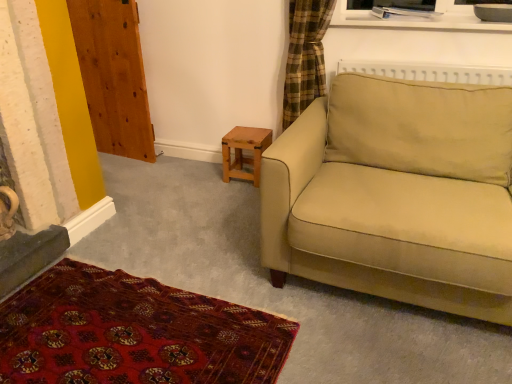
Locate an element on the screen. free space underneath wooden at left (from a real-world perspective) is located at coordinates (113, 150).